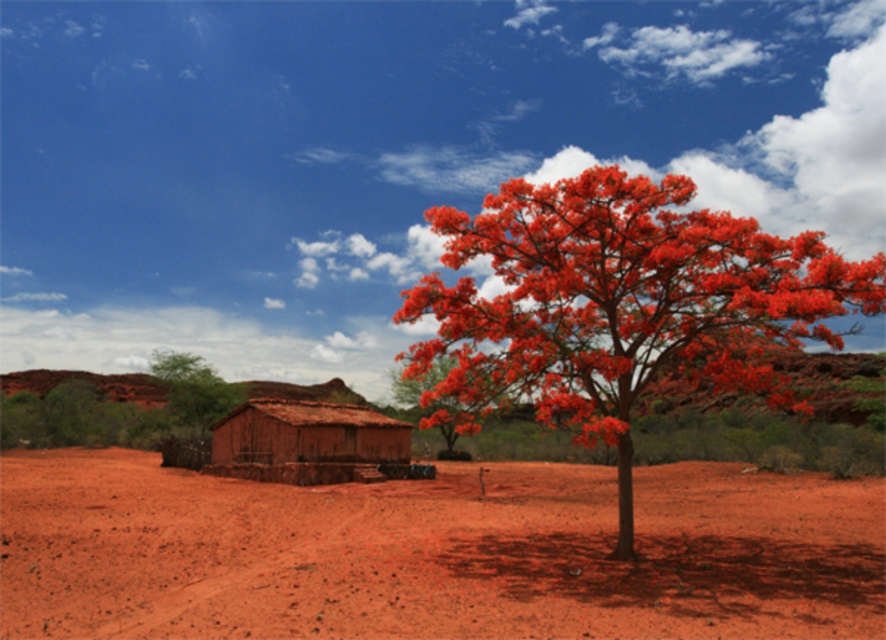
Does point (545, 344) lie in front of point (254, 404)?

That is True.

Is bright red petal at upper right smaller than brown clay hut at center?

No.

Who is more distant from viewer, [408,291] or [407,442]?

Point [407,442]

Locate an element on the screen. The width and height of the screenshot is (886, 640). bright red petal at upper right is located at coordinates (620, 301).

Is dusty red dirt field at center taller than brown clay hut at center?

In fact, dusty red dirt field at center may be shorter than brown clay hut at center.

How distant is dusty red dirt field at center from brown clay hut at center?

dusty red dirt field at center and brown clay hut at center are 7.47 meters apart from each other.

Between point (486, 518) and point (340, 452), which one is positioned in front?

Positioned in front is point (486, 518).

Image resolution: width=886 pixels, height=640 pixels. Find the location of `dusty red dirt field at center`. dusty red dirt field at center is located at coordinates point(432,552).

Is point (449, 496) behind point (677, 246)?

Yes, it is behind point (677, 246).

The image size is (886, 640). What do you see at coordinates (432, 552) in the screenshot? I see `dusty red dirt field at center` at bounding box center [432, 552].

Which is behind, point (375, 525) or point (782, 378)?

The point (375, 525) is behind.

Image resolution: width=886 pixels, height=640 pixels. Find the location of `dusty red dirt field at center`. dusty red dirt field at center is located at coordinates (432, 552).